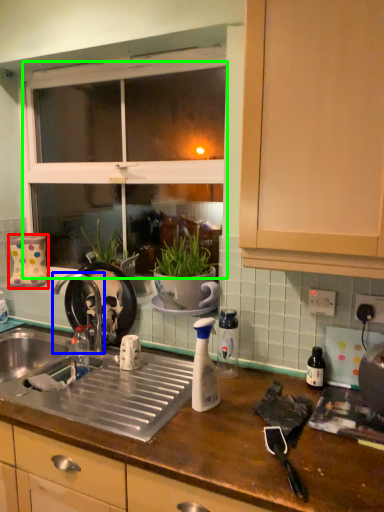
Question: Which object is positioned closest to appliance (highlighted by a red box)? Select from tap (highlighted by a blue box) and window screen (highlighted by a green box).

Choices:
 (A) tap
 (B) window screen

Answer: (A)